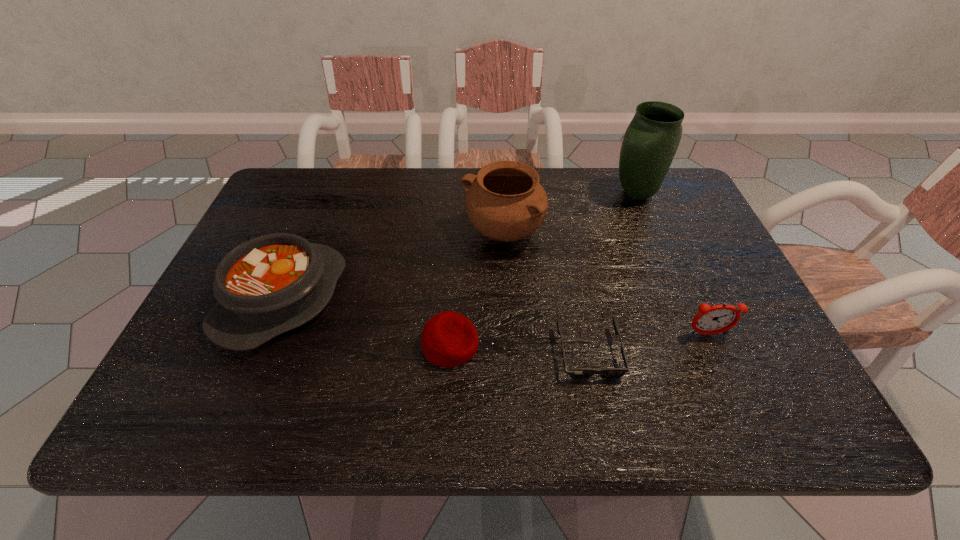
Find the location of a particular element. This screenshot has width=960, height=540. vacant space located 0.070m on the front-facing side of the alarm clock is located at coordinates (722, 367).

Identify the location of free space located 0.330m on the seat area of the fifth tallest object. (635, 345).

At what (x,y) coordinates should I click in order to perform the action: click on vacant position located 0.100m on the temples of the shortest object. Please return your answer as a coordinate pair (x, y). Looking at the image, I should click on (605, 431).

You are a GUI agent. You are given a task and a screenshot of the screen. Output one action in this format:
    pyautogui.click(x=<x>, y=<y>)
    Task: Click on the vase present at the far edge
    The height and width of the screenshot is (540, 960).
    Given the screenshot: What is the action you would take?
    pyautogui.click(x=651, y=140)

Find the location of a particular element. pottery that is at the far edge is located at coordinates (505, 202).

Where is `object located at the left edge`? object located at the left edge is located at coordinates (268, 285).

Locate an element on the screen. The width and height of the screenshot is (960, 540). vase that is positioned at the right edge is located at coordinates (651, 140).

What are the coordinates of `alarm clock present at the right edge` in the screenshot? It's located at (710, 320).

Where is `object that is at the far right corner`? object that is at the far right corner is located at coordinates (651, 140).

This screenshot has width=960, height=540. Identify the location of vacant space at the far edge. (397, 206).